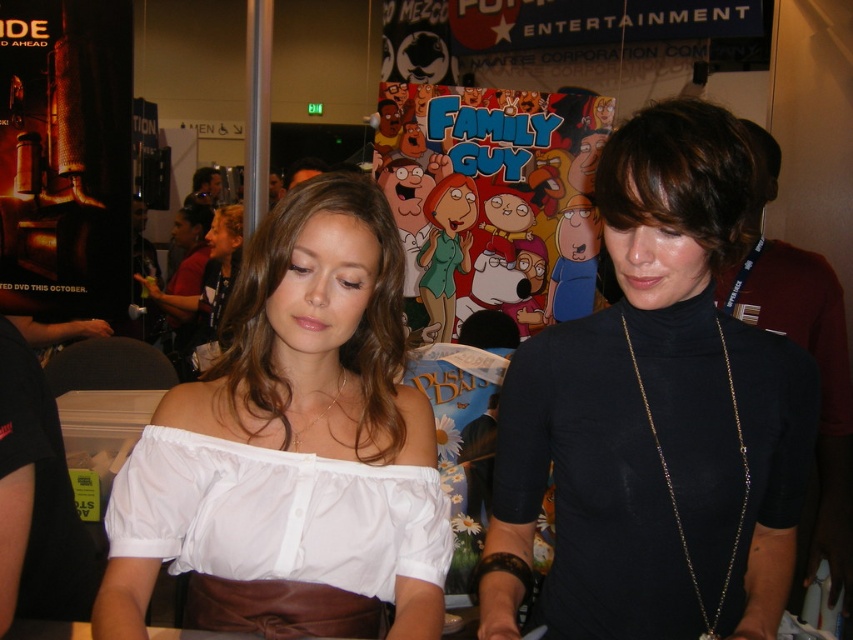
Can you confirm if white cotton blouse at center is positioned above white satin blouse at center?

No.

Is white cotton blouse at center shorter than white satin blouse at center?

No, white cotton blouse at center is not shorter than white satin blouse at center.

Does point (416, 445) come in front of point (352, 348)?

Yes, point (416, 445) is in front of point (352, 348).

Image resolution: width=853 pixels, height=640 pixels. Find the location of `white cotton blouse at center`. white cotton blouse at center is located at coordinates coord(293,433).

Can you confirm if black matte turtleneck at center is positioned to the left of white satin blouse at center?

In fact, black matte turtleneck at center is to the right of white satin blouse at center.

Is black matte turtleneck at center positioned in front of white satin blouse at center?

Yes, black matte turtleneck at center is closer to the viewer.

At what (x,y) coordinates should I click in order to perform the action: click on black matte turtleneck at center. Please return your answer as a coordinate pair (x, y). Looking at the image, I should click on click(x=654, y=417).

Does cartoon characters at center have a greater height compared to white satin dress at center?

Correct, cartoon characters at center is much taller as white satin dress at center.

Who is positioned more to the left, cartoon characters at center or white satin dress at center?

white satin dress at center

Is point (544, 132) positioned behind point (363, 595)?

That is True.

Find the location of `cartoon characters at center`. cartoon characters at center is located at coordinates (491, 198).